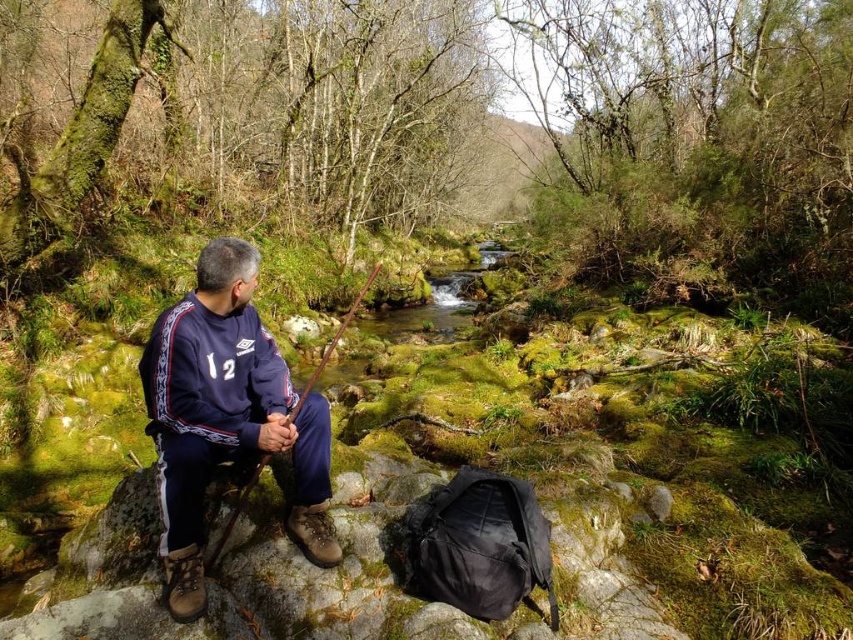
Question: Which point is farther to the camera?

Choices:
 (A) (364, 284)
 (B) (329, 461)

Answer: (A)

Question: Is dark blue fleece at center wider than brown wooden fishing pole at left?

Choices:
 (A) no
 (B) yes

Answer: (A)

Question: Does dark blue fleece at center appear over brown wooden fishing pole at left?

Choices:
 (A) yes
 (B) no

Answer: (B)

Question: Which object appears farthest from the camera in this image?

Choices:
 (A) dark blue fleece at center
 (B) brown wooden fishing pole at left

Answer: (B)

Question: Does dark blue fleece at center have a greater width compared to brown wooden fishing pole at left?

Choices:
 (A) no
 (B) yes

Answer: (A)